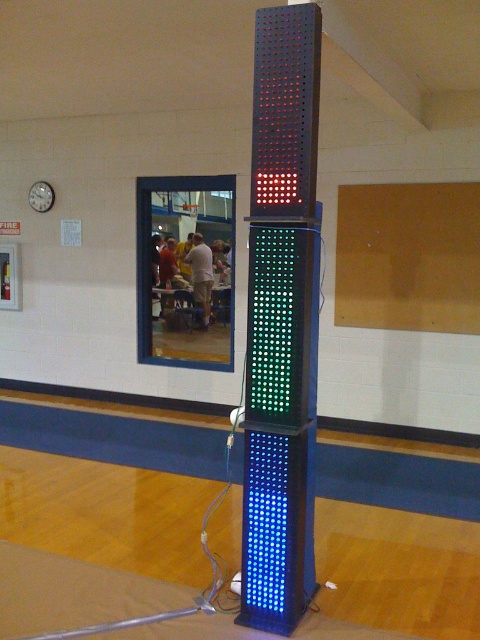
Can you confirm if multicolored led display at center is positioned to the right of metallic wall clock at upper left?

Indeed, multicolored led display at center is positioned on the right side of metallic wall clock at upper left.

The image size is (480, 640). What do you see at coordinates (280, 321) in the screenshot?
I see `multicolored led display at center` at bounding box center [280, 321].

You are a GUI agent. You are given a task and a screenshot of the screen. Output one action in this format:
    pyautogui.click(x=<x>, y=<y>)
    Task: Click on the multicolored led display at center
    
    Given the screenshot: What is the action you would take?
    pyautogui.click(x=280, y=321)

The width and height of the screenshot is (480, 640). Find the location of `multicolored led display at center`. multicolored led display at center is located at coordinates (280, 321).